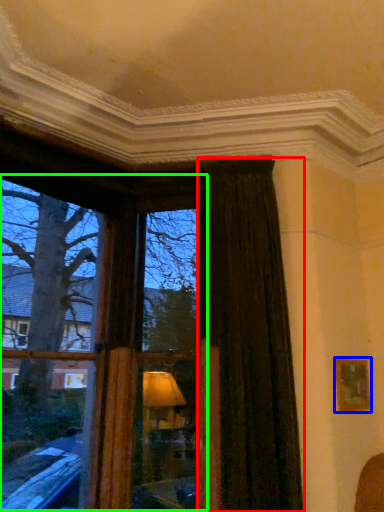
Question: Which is farther away from curtain (highlighted by a red box)? picture frame (highlighted by a blue box) or bay window (highlighted by a green box)?

Choices:
 (A) picture frame
 (B) bay window

Answer: (B)